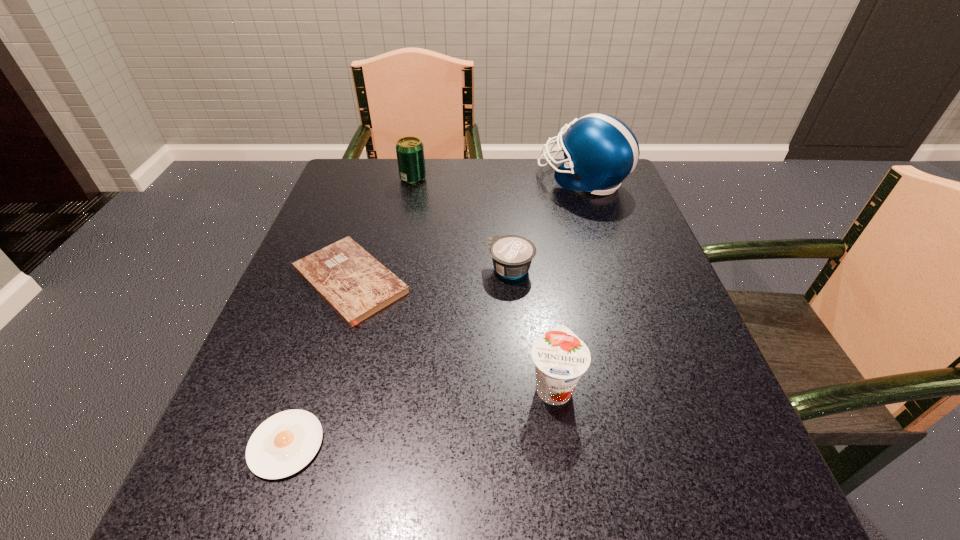
This screenshot has width=960, height=540. What are the coordinates of `the tallest object` in the screenshot? It's located at (600, 151).

At what (x,y) coordinates should I click in order to perform the action: click on beer can. Please return your answer as a coordinate pair (x, y). The image size is (960, 540). Looking at the image, I should click on (410, 151).

Identify the location of the taller yogurt. The height and width of the screenshot is (540, 960). (560, 357).

This screenshot has height=540, width=960. Identify the location of the nearer yogurt. (560, 357).

At what (x,y) coordinates should I click in order to perform the action: click on the fourth tallest object. Please return your answer as a coordinate pair (x, y). This screenshot has height=540, width=960. Looking at the image, I should click on (512, 255).

Image resolution: width=960 pixels, height=540 pixels. In order to click on the shorter yogurt in this screenshot , I will do `click(512, 255)`.

The height and width of the screenshot is (540, 960). What are the coordinates of `the fifth tallest object` in the screenshot? It's located at 351,281.

The image size is (960, 540). What are the coordinates of `egg yolk` in the screenshot? It's located at (282, 445).

Image resolution: width=960 pixels, height=540 pixels. I want to click on vacant space located 0.140m at the front of the football helmet with the faceguard, so click(485, 180).

Identify the location of vacant space situated 0.100m at the front of the football helmet with the faceguard. The height and width of the screenshot is (540, 960). (500, 180).